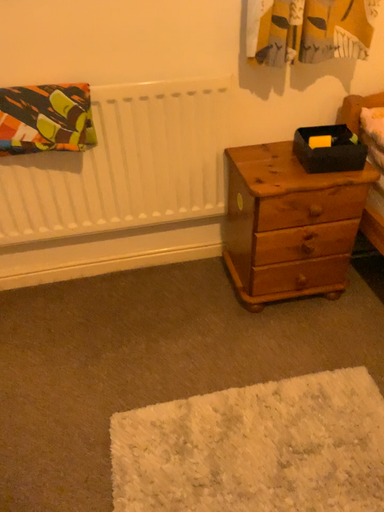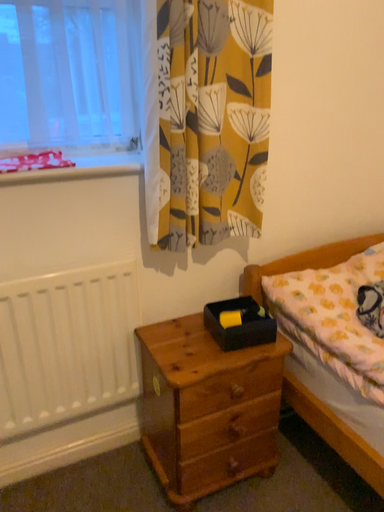
Question: Which way did the camera rotate in the video?

Choices:
 (A) rotated left
 (B) rotated right

Answer: (B)